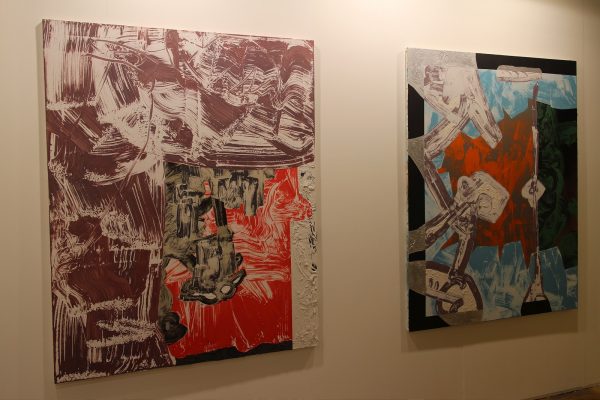
The image size is (600, 400). Identify the location of textured off-white area on painting. (300, 265).